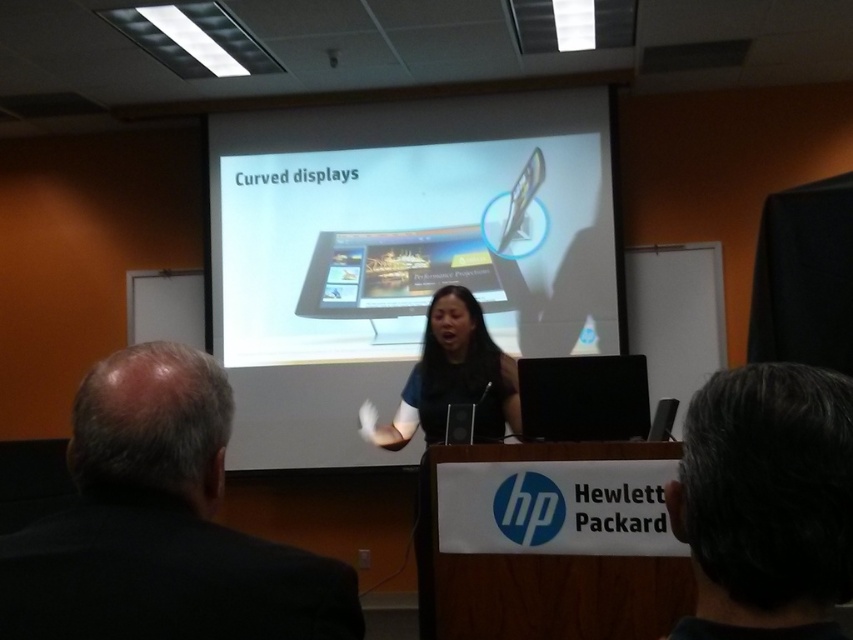
You are sitting in the audience and looking at the projection screen. There are two points on the screen at coordinates point (x=106, y=385) and point (x=807, y=454). Which point is closer to you?

Point (x=106, y=385) is further to the viewer than point (x=807, y=454), so the point closer to you is point (x=807, y=454).

You are a photographer setting up for a group photo. You have a camera with a lens that can focus on objects within a 5 cm range. You need to capture both the black fabric dress at center and the black fabric shirt at center in sharp focus. Is this possible with your current camera settings?

The distance between the black fabric dress at center and the black fabric shirt at center is 5.77 centimeters. Since your camera can focus within a 5 cm range, the 5.77 cm gap exceeds this limit, making it impossible to have both in sharp focus simultaneously.

You are organizing a photo shoot and need to decide which outfit takes up more space when standing. Based on the scene, which clothing item is wider between the dark gray suit at left and the black fabric dress at center?

The dark gray suit at left has a lesser width compared to the black fabric dress at center, so the black fabric dress at center is wider.